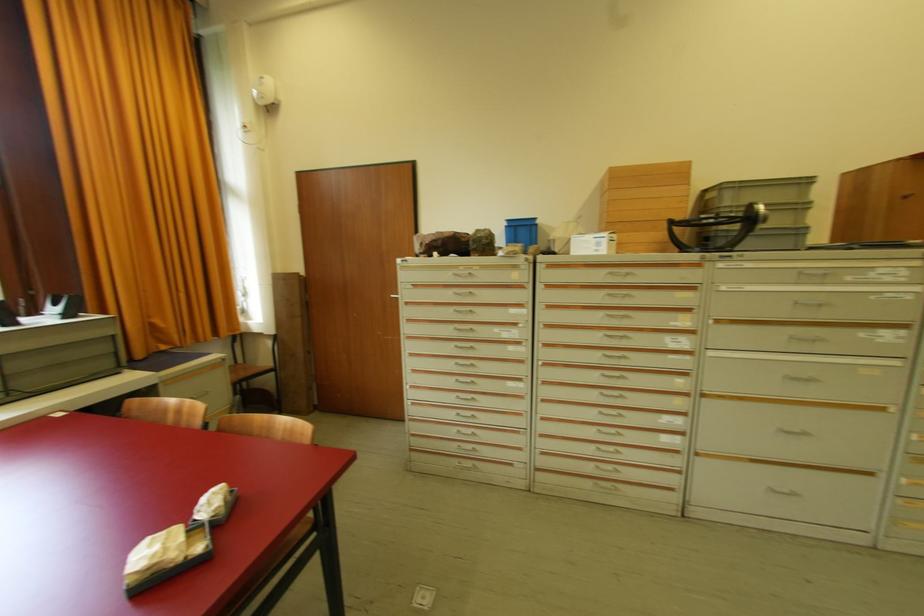
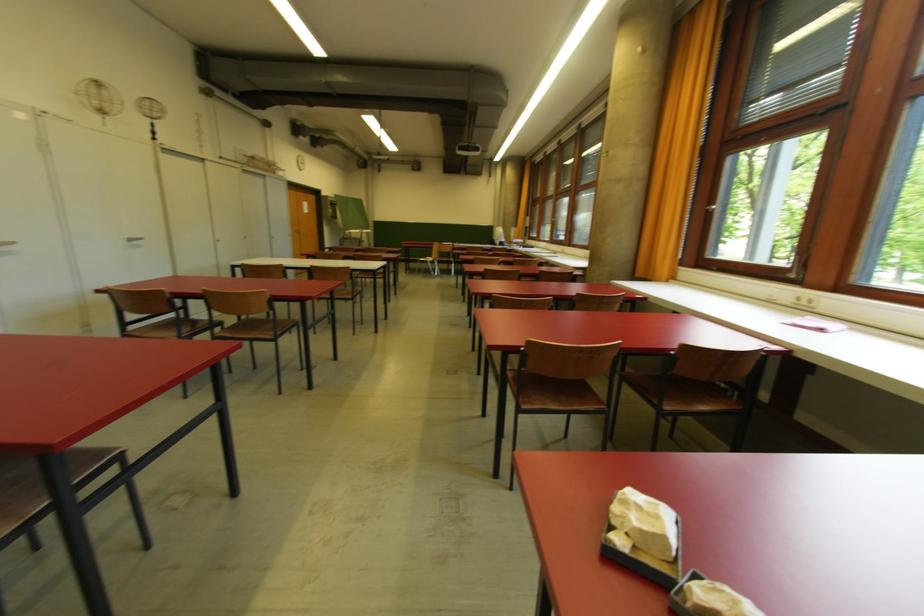
The point at [183,545] is marked in the first image. Where is the corresponding point in the second image?

(633, 522)